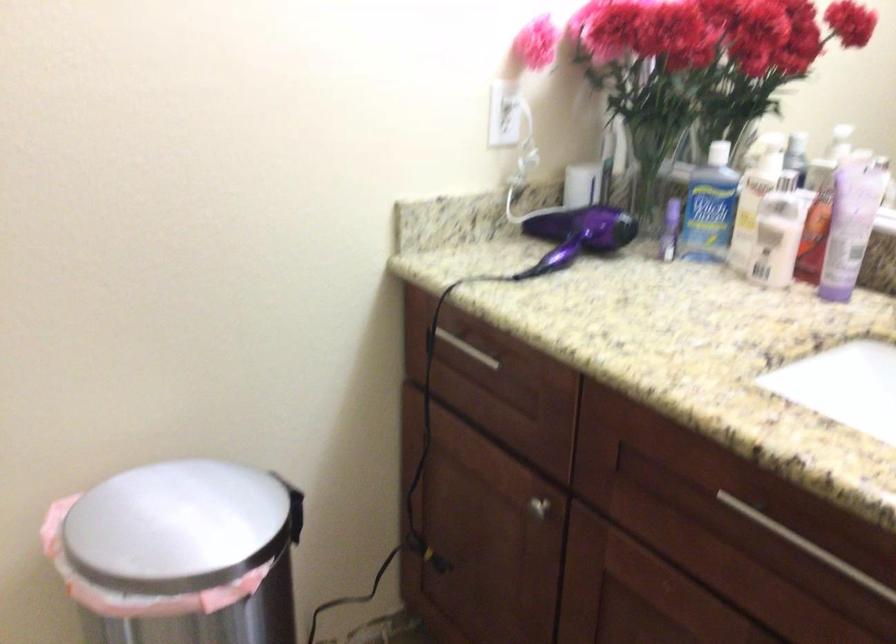
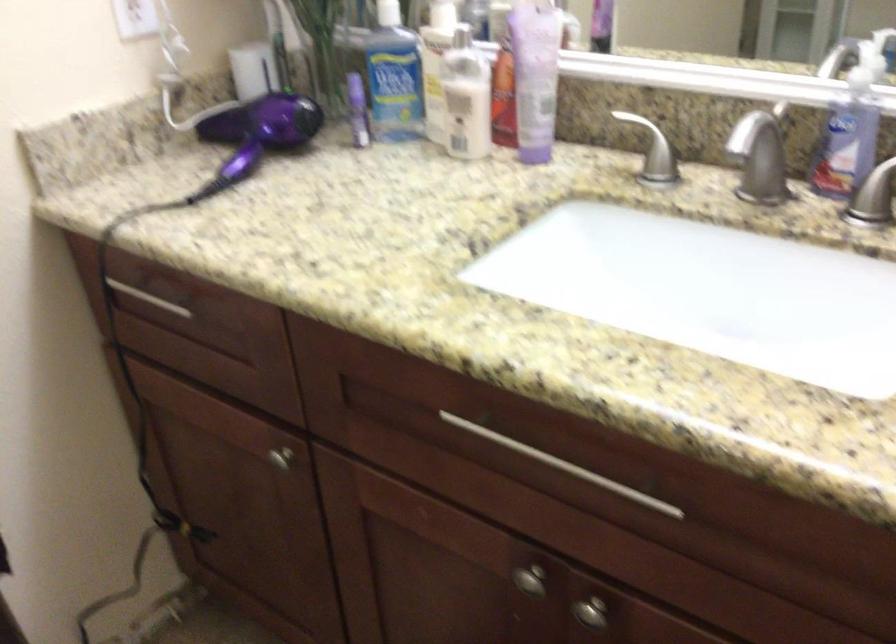
The point at (575,230) is marked in the first image. Where is the corresponding point in the second image?

(256, 134)